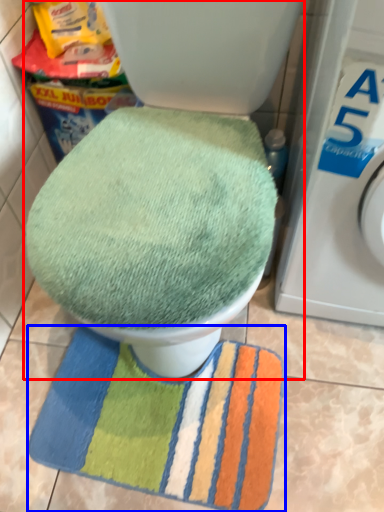
Question: Which point is further to the camera, toilet (highlighted by a red box) or beach towel (highlighted by a blue box)?

Choices:
 (A) toilet
 (B) beach towel

Answer: (B)